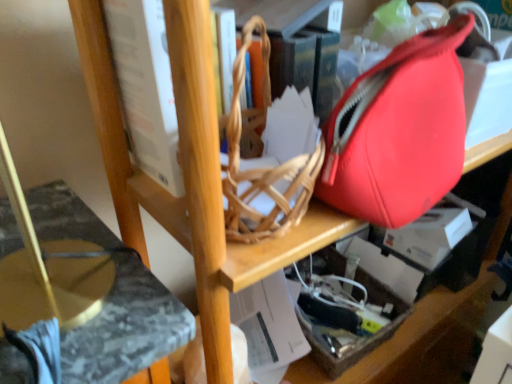
Question: Considering the positions of marble-patterned swivel chair at lower left and translucent plastic box at lower right in the image, is marble-patterned swivel chair at lower left bigger or smaller than translucent plastic box at lower right?

Choices:
 (A) big
 (B) small

Answer: (A)

Question: Is marble-patterned swivel chair at lower left to the left or to the right of translucent plastic box at lower right in the image?

Choices:
 (A) left
 (B) right

Answer: (A)

Question: Which of these objects is positioned closest to the marble-patterned swivel chair at lower left?

Choices:
 (A) translucent plastic box at lower right
 (B) white paperboard book at upper center
 (C) matte red tote bag at right

Answer: (B)

Question: Which object is positioned closest to the white paperboard book at upper center?

Choices:
 (A) translucent plastic box at lower right
 (B) matte red tote bag at right
 (C) marble-patterned swivel chair at lower left

Answer: (C)